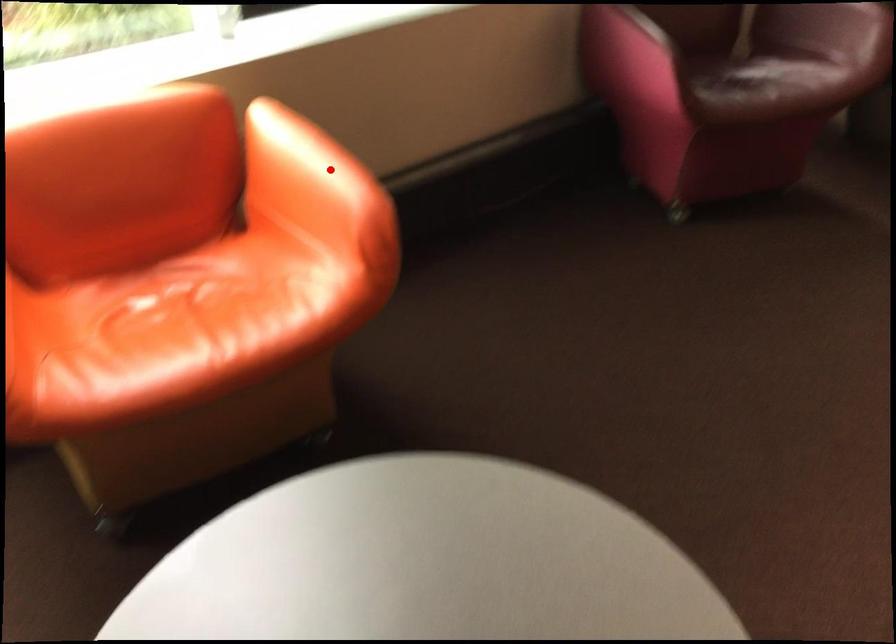
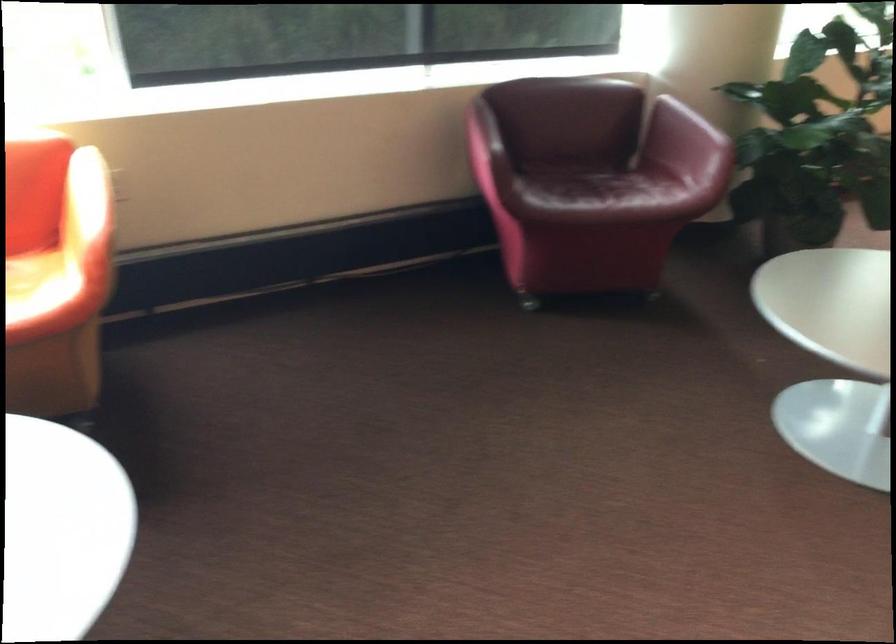
Question: A red point is marked in image1. In image2, is the corresponding 3D point closer to the camera or farther? Reply with the corresponding letter.

Choices:
 (A) The corresponding 3D point is closer.
 (B) The corresponding 3D point is farther.

Answer: (B)